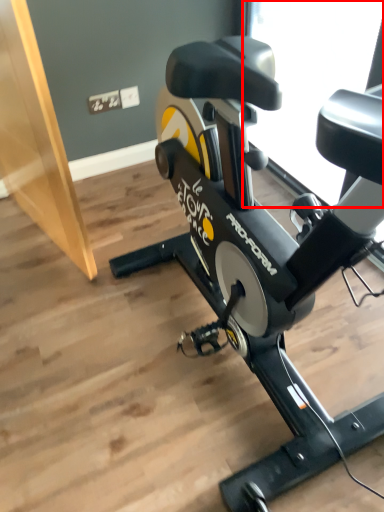
Question: From the image's perspective, where is window screen (annotated by the red box) located relative to stationary bicycle?

Choices:
 (A) above
 (B) below

Answer: (A)